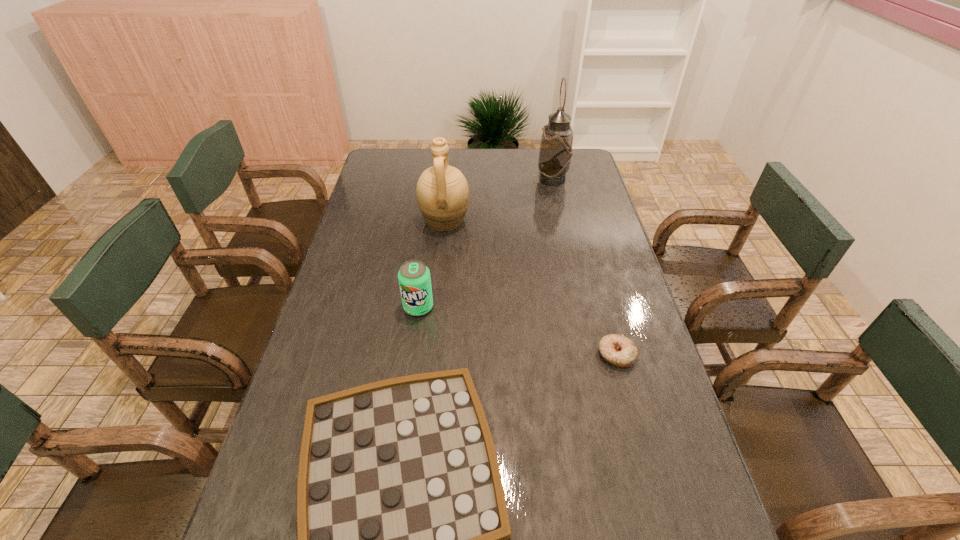
Identify the location of free region located on the front-facing side of the pop soda. (414, 341).

This screenshot has height=540, width=960. I want to click on vacant area situated 0.140m on the back of the second nearest object, so click(602, 301).

At what (x,y) coordinates should I click in order to perform the action: click on object that is at the far edge. Please return your answer as a coordinate pair (x, y). This screenshot has width=960, height=540. Looking at the image, I should click on (556, 152).

This screenshot has height=540, width=960. What are the coordinates of `oil lamp that is at the right edge` in the screenshot? It's located at (556, 152).

Where is `doughnut present at the right edge`? The height and width of the screenshot is (540, 960). doughnut present at the right edge is located at coordinates (618, 350).

Find the location of a particular element. The image size is (960, 540). object located in the far right corner section of the desktop is located at coordinates (556, 152).

The image size is (960, 540). I want to click on vacant space at the far edge of the desktop, so click(x=540, y=148).

Identify the location of blank space at the left edge of the desktop. Image resolution: width=960 pixels, height=540 pixels. (250, 519).

Image resolution: width=960 pixels, height=540 pixels. In the image, there is a desktop. In order to click on free space at the right edge in this screenshot , I will do `click(583, 297)`.

Find the location of `vacant position at the far right corner of the desktop`. vacant position at the far right corner of the desktop is located at coordinates (583, 164).